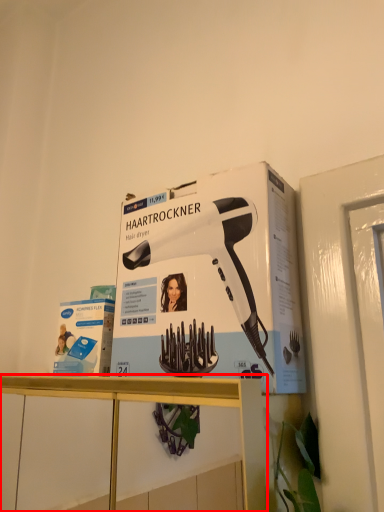
Question: From the image, what is the correct spatial relationship of furniture (annotated by the red box) in relation to hair drier?

Choices:
 (A) right
 (B) left

Answer: (B)